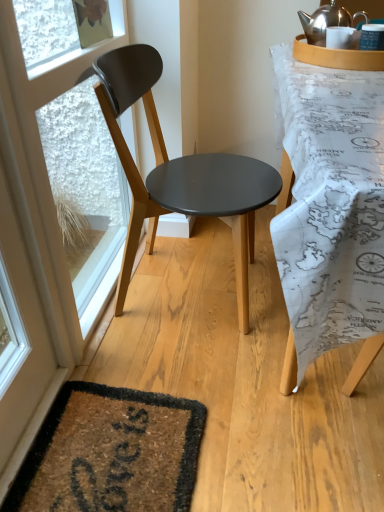
Question: Would you say map-patterned fabric at right is inside or outside matte black chair at center?

Choices:
 (A) outside
 (B) inside

Answer: (A)

Question: Looking at their shapes, would you say map-patterned fabric at right is wider or thinner than matte black chair at center?

Choices:
 (A) wide
 (B) thin

Answer: (A)

Question: Which object is the farthest from the matte black chair at center?

Choices:
 (A) map-patterned fabric at right
 (B) white plastic window frame at left
 (C) polished silver kettle at upper right

Answer: (C)

Question: Estimate the real-world distances between objects in this image. Which object is closer to the white plastic window frame at left?

Choices:
 (A) polished silver kettle at upper right
 (B) map-patterned fabric at right
 (C) matte black chair at center

Answer: (C)